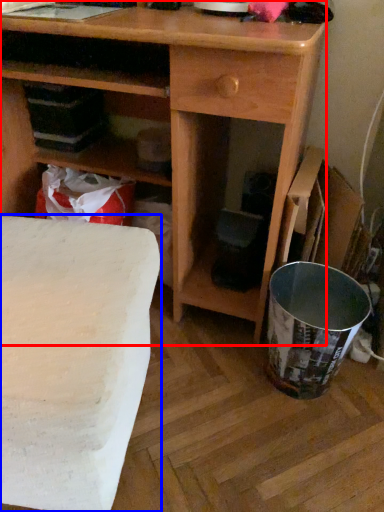
Question: Which of the following is the farthest to the observer, desk (highlighted by a red box) or table (highlighted by a blue box)?

Choices:
 (A) desk
 (B) table

Answer: (A)